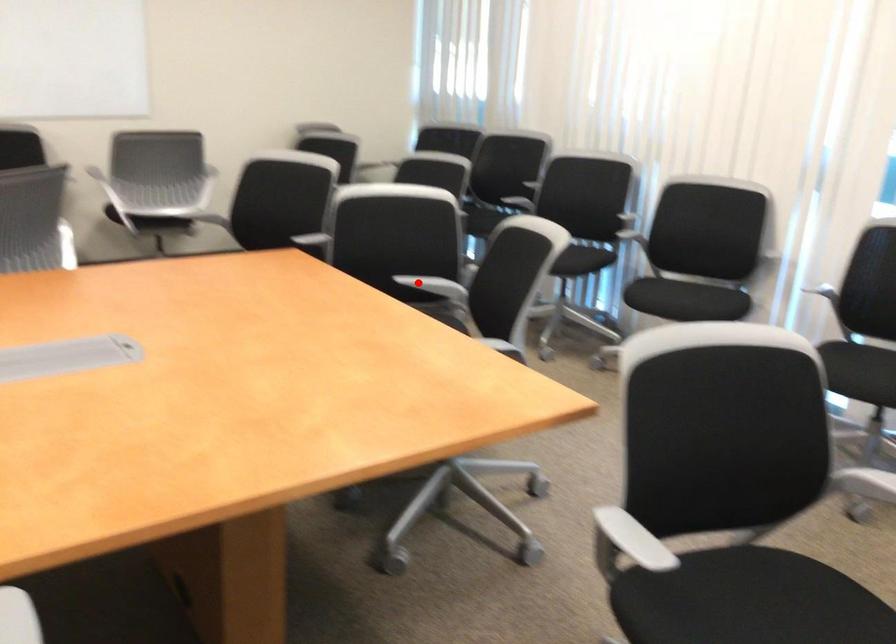
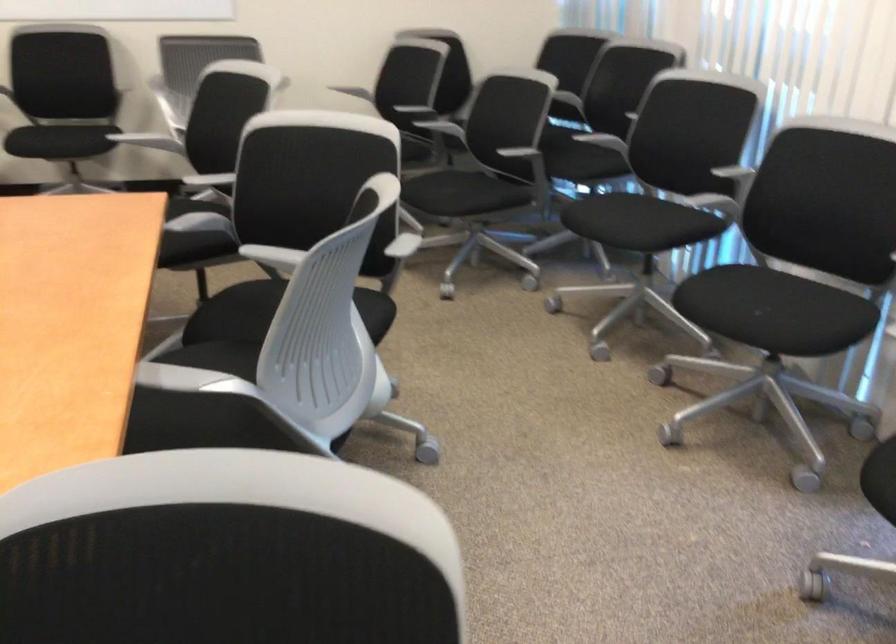
Question: I am providing you with two images of the same scene from different viewpoints. Given a red point in image1, look at the same physical point in image2. Is it:

Choices:
 (A) Closer to the viewpoint
 (B) Farther from the viewpoint

Answer: (A)